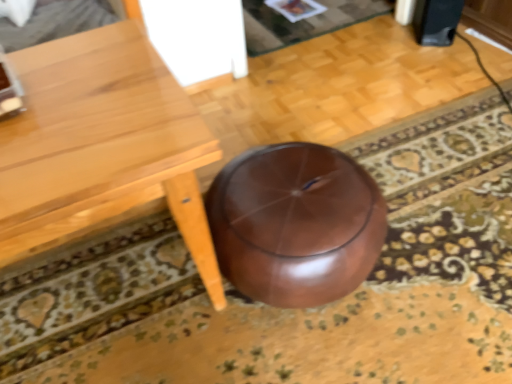
This screenshot has width=512, height=384. I want to click on free space above light brown wooden table at lower right (from a real-world perspective), so click(66, 93).